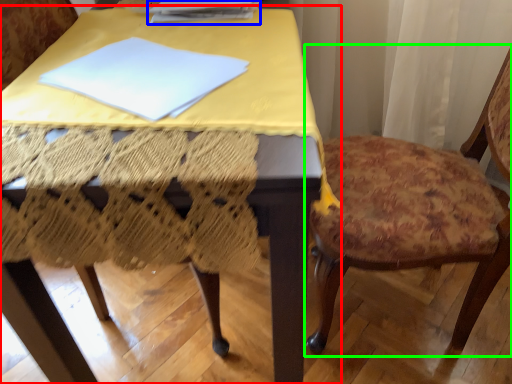
Question: Considering the real-world distances, which object is closest to table (highlighted by a red box)? paperback book (highlighted by a blue box) or chair (highlighted by a green box).

Choices:
 (A) paperback book
 (B) chair

Answer: (A)